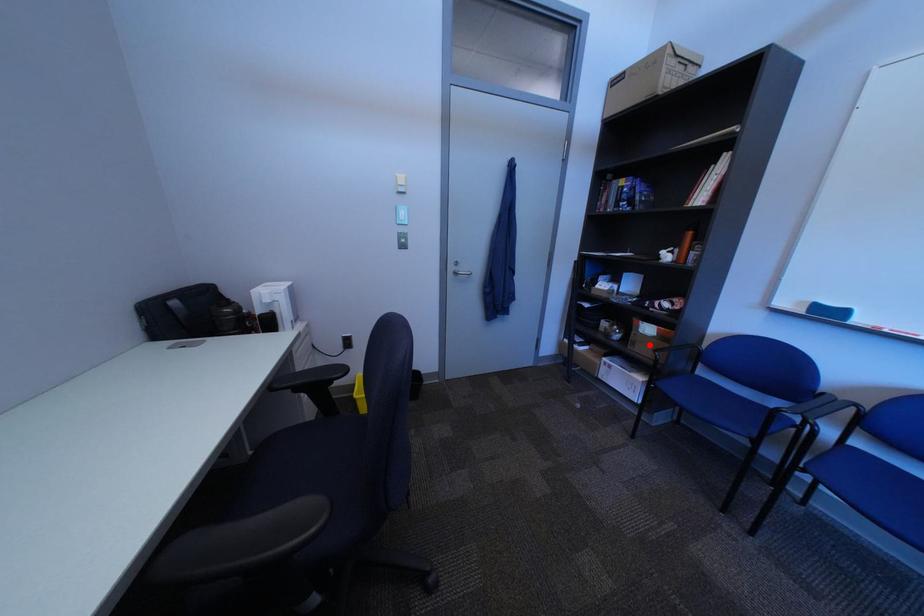
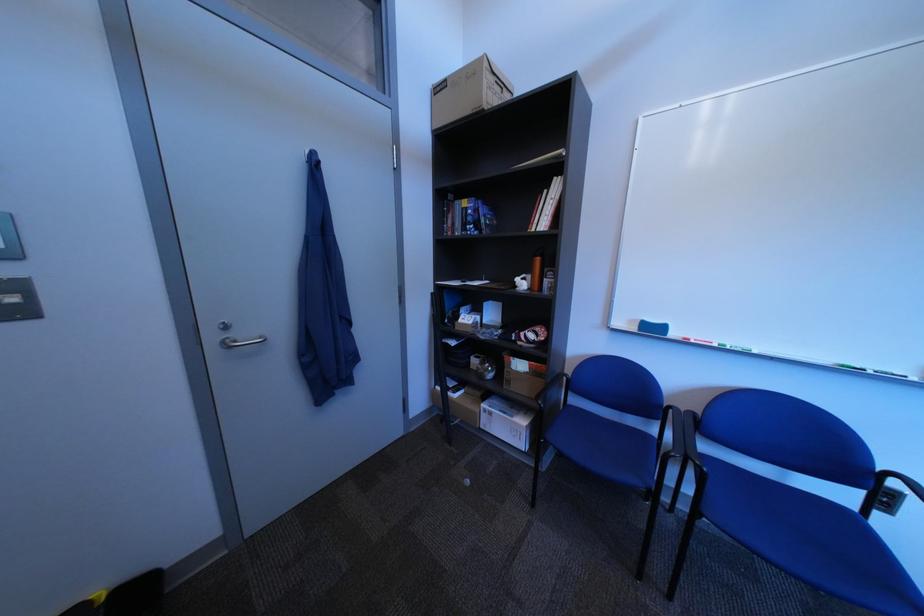
Question: I am providing you with two images of the same scene from different viewpoints. A red point is marked on the first image. Is the red point's position out of view in image 2?

Choices:
 (A) Yes
 (B) No

Answer: (B)